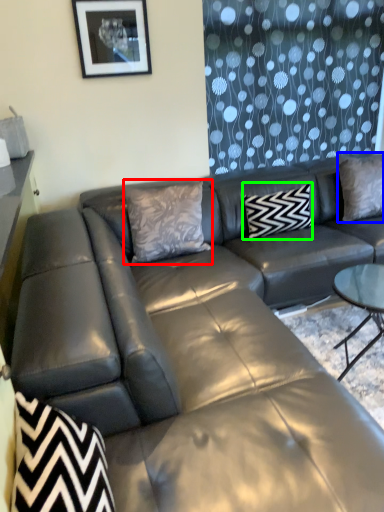
Question: Based on their relative distances, which object is nearer to pillow (highlighted by a red box)? Choose from pillow (highlighted by a blue box) and pillow (highlighted by a green box).

Choices:
 (A) pillow
 (B) pillow

Answer: (B)